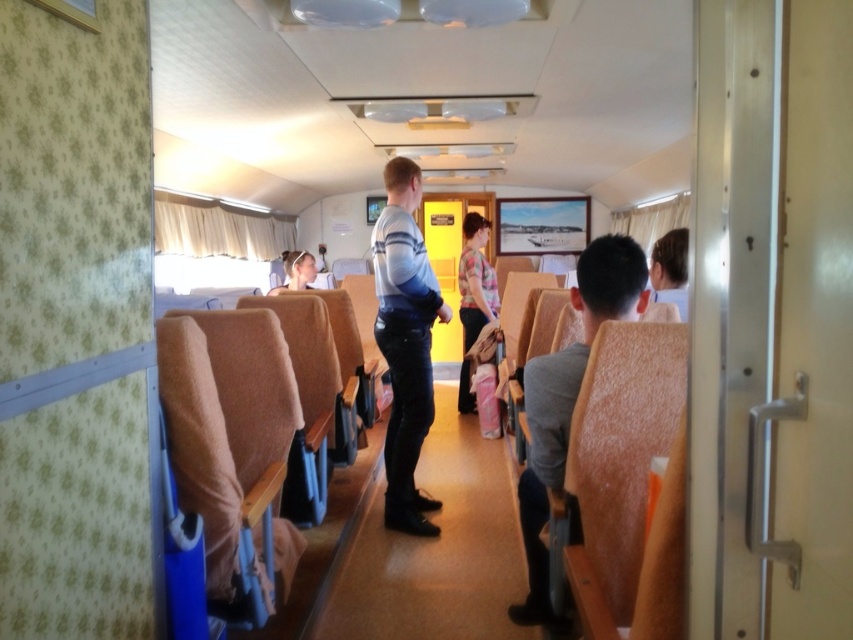
You are a person standing at the entrance of the train car and want to reach the brown fabric seat at center. There is a person wearing a floral shirt at center blocking your path. Can you walk around them without needing to squeeze, considering the aisle is 1.5 meters wide?

The distance between the brown fabric seat at center and the floral shirt at center is 1.47 meters. Since the aisle is 1.5 meters wide, you have enough space to walk around the person wearing the floral shirt at center without needing to squeeze.

You are a passenger on this vintage train car and want to place your gray fabric jacket at center on the brown fabric seat at center. Is there enough space between them to do so comfortably?

The brown fabric seat at center and gray fabric jacket at center are 31.88 inches apart. Since 31.88 inches is more than enough space to place the jacket comfortably, yes, you can do so.